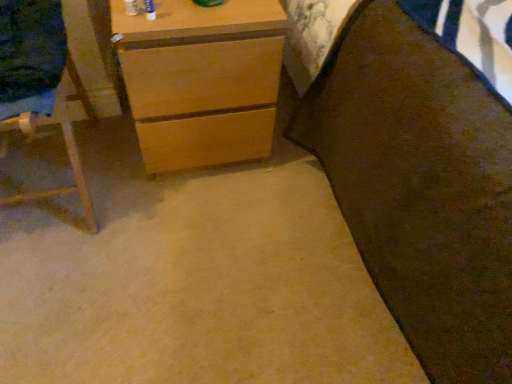
What do you see at coordinates (420, 187) in the screenshot? This screenshot has height=384, width=512. I see `brown fabric bed at right` at bounding box center [420, 187].

The width and height of the screenshot is (512, 384). I want to click on light brown wood chest of drawers at upper left, so click(x=201, y=80).

Which is less distant, (241,113) or (83,179)?

The point (83,179) is in front.

Does light brown wood chest of drawers at upper left turn towards wooden easel at left?

No, light brown wood chest of drawers at upper left does not turn towards wooden easel at left.

Is light brown wood chest of drawers at upper left to the left of wooden easel at left from the viewer's perspective?

Incorrect, light brown wood chest of drawers at upper left is not on the left side of wooden easel at left.

Would you consider light brown wood chest of drawers at upper left to be distant from wooden easel at left?

That's not correct — light brown wood chest of drawers at upper left is a little close to wooden easel at left.

Is brown fabric bed at right not inside wooden easel at left?

Yes.

Visually, is brown fabric bed at right positioned to the left or to the right of wooden easel at left?

Based on their positions, brown fabric bed at right is located to the right of wooden easel at left.

Are brown fabric bed at right and wooden easel at left located far from each other?

No, there isn't a large distance between brown fabric bed at right and wooden easel at left.

From a real-world perspective, who is located higher, brown fabric bed at right or wooden easel at left?

brown fabric bed at right, from a real-world perspective.

Can you confirm if wooden easel at left is thinner than brown fabric bed at right?

Correct, the width of wooden easel at left is less than that of brown fabric bed at right.

How many degrees apart are the facing directions of wooden easel at left and brown fabric bed at right?

0.65 degrees.

Are wooden easel at left and brown fabric bed at right beside each other?

No, wooden easel at left is not beside brown fabric bed at right.

Does wooden easel at left have a greater height compared to brown fabric bed at right?

In fact, wooden easel at left may be shorter than brown fabric bed at right.

From a real-world perspective, is brown fabric bed at right physically located above or below light brown wood chest of drawers at upper left?

brown fabric bed at right is situated higher than light brown wood chest of drawers at upper left in the real world.

Between brown fabric bed at right and light brown wood chest of drawers at upper left, which one appears on the right side from the viewer's perspective?

From the viewer's perspective, brown fabric bed at right appears more on the right side.

How much distance is there between brown fabric bed at right and light brown wood chest of drawers at upper left?

brown fabric bed at right and light brown wood chest of drawers at upper left are 37.06 centimeters apart.

In order to click on bed in front of the light brown wood chest of drawers at upper left in this screenshot , I will do `click(420, 187)`.

Is light brown wood chest of drawers at upper left outside of brown fabric bed at right?

Yes, light brown wood chest of drawers at upper left is outside of brown fabric bed at right.

From the image's perspective, which object appears higher, light brown wood chest of drawers at upper left or brown fabric bed at right?

light brown wood chest of drawers at upper left is shown above in the image.

Visually, is light brown wood chest of drawers at upper left positioned to the left or to the right of brown fabric bed at right?

light brown wood chest of drawers at upper left is positioned on brown fabric bed at right's left side.

From a real-world perspective, is light brown wood chest of drawers at upper left positioned over brown fabric bed at right based on gravity?

No.

From a real-world perspective, which object rests below the other?

From a 3D spatial view, light brown wood chest of drawers at upper left is below.

Is wooden easel at left directly adjacent to light brown wood chest of drawers at upper left?

No, wooden easel at left is not beside light brown wood chest of drawers at upper left.

Is point (16, 83) more distant than point (165, 135)?

No, (16, 83) is closer to viewer.

Which object is wider, wooden easel at left or light brown wood chest of drawers at upper left?

Wider between the two is light brown wood chest of drawers at upper left.

In order to click on chest of drawers below the wooden easel at left (from a real-world perspective) in this screenshot , I will do pos(201,80).

The width and height of the screenshot is (512, 384). I want to click on furniture behind the brown fabric bed at right, so click(40, 94).

Estimate the real-world distances between objects in this image. Which object is closer to light brown wood chest of drawers at upper left, brown fabric bed at right or wooden easel at left?

Among the two, wooden easel at left is located nearer to light brown wood chest of drawers at upper left.

Which object lies nearer to the anchor point light brown wood chest of drawers at upper left, wooden easel at left or brown fabric bed at right?

wooden easel at left lies closer to light brown wood chest of drawers at upper left than the other object.

Considering their positions, is wooden easel at left positioned closer to brown fabric bed at right than light brown wood chest of drawers at upper left?

Based on the image, light brown wood chest of drawers at upper left appears to be nearer to brown fabric bed at right.

Considering their positions, is brown fabric bed at right positioned further to wooden easel at left than light brown wood chest of drawers at upper left?

The object further to wooden easel at left is brown fabric bed at right.

Looking at the image, which one is located closer to wooden easel at left, light brown wood chest of drawers at upper left or brown fabric bed at right?

light brown wood chest of drawers at upper left.

From the image, which object appears to be nearer to brown fabric bed at right, light brown wood chest of drawers at upper left or wooden easel at left?

The object closer to brown fabric bed at right is light brown wood chest of drawers at upper left.

Locate an element on the screen. The height and width of the screenshot is (384, 512). the chest of drawers located between wooden easel at left and brown fabric bed at right in the left-right direction is located at coordinates (201, 80).